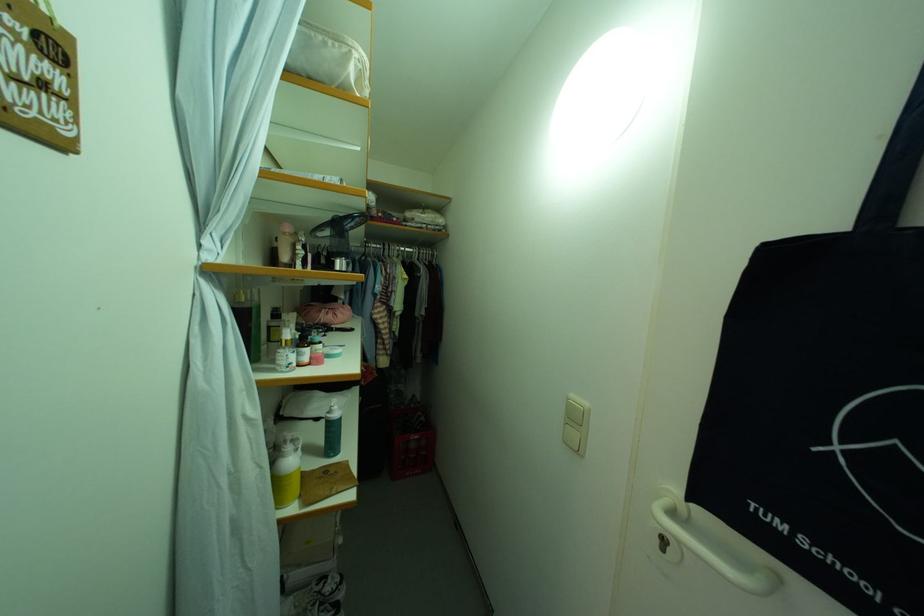
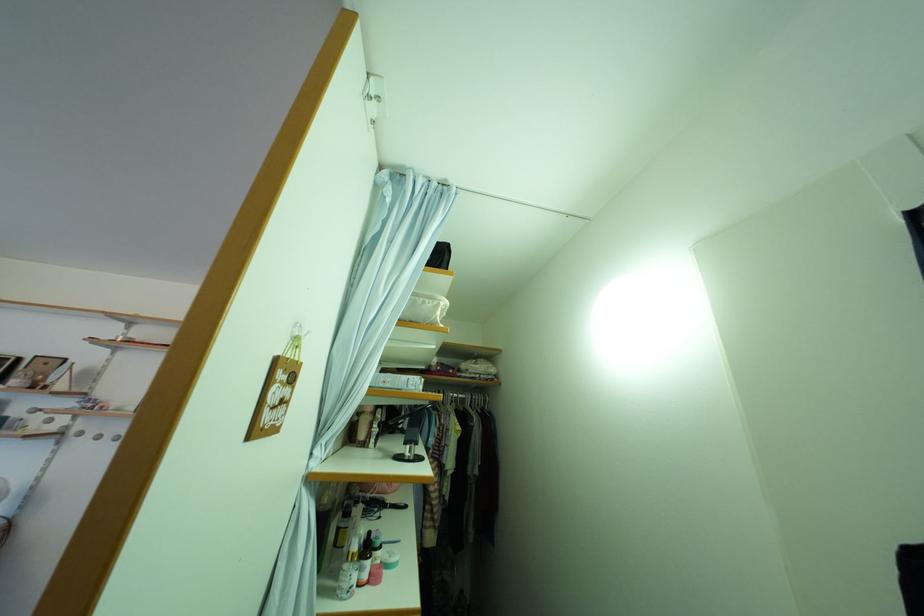
Where in the second image is the point corresponding to (x=334, y=51) from the first image?

(432, 309)